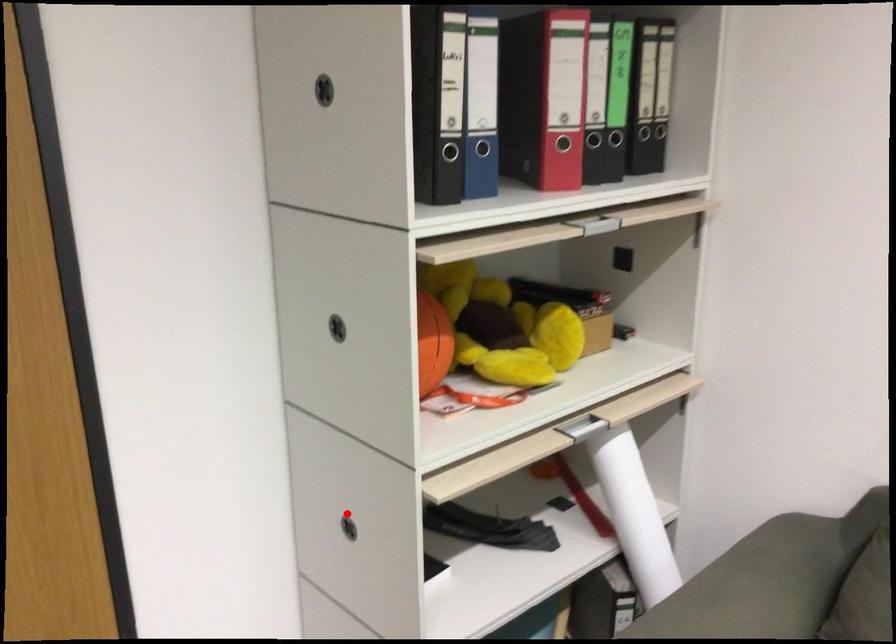
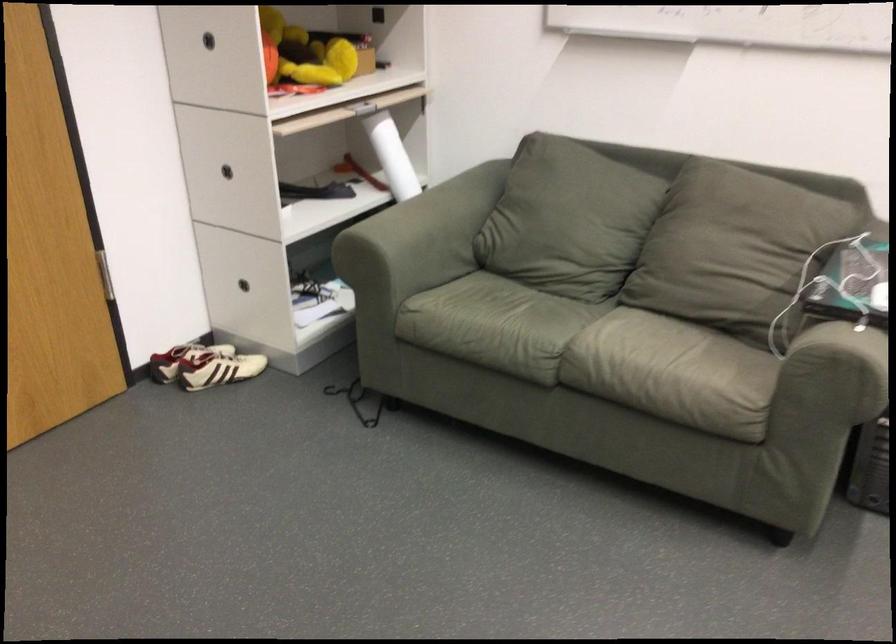
Where in the second image is the point corresponding to the highlighted location from the first image?

(227, 171)